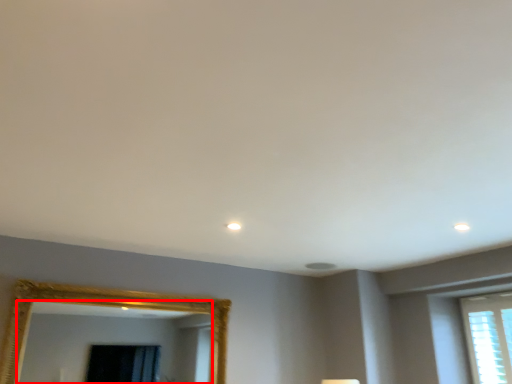
Question: Considering the relative positions of mirror (annotated by the red box) and window in the image provided, where is mirror (annotated by the red box) located with respect to the staircase?

Choices:
 (A) left
 (B) right

Answer: (A)